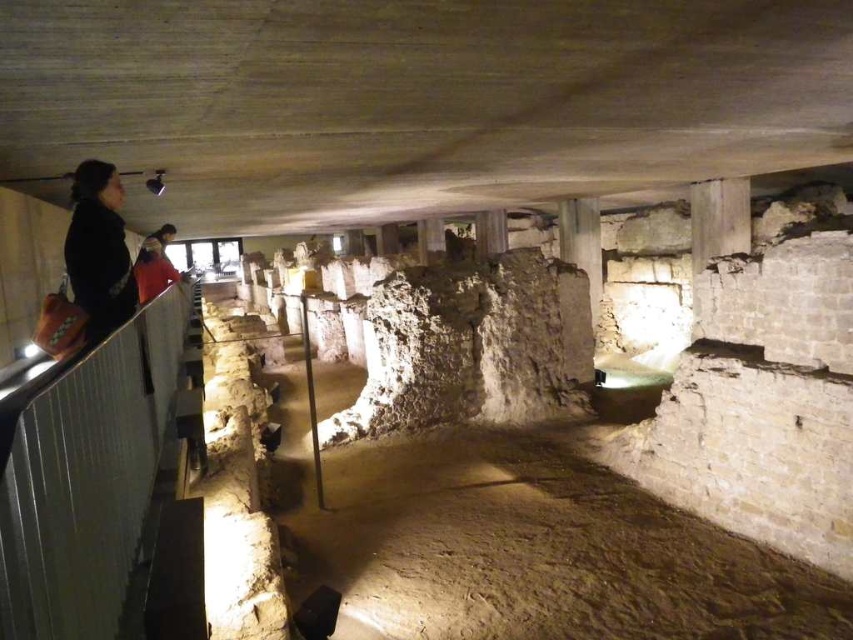
Looking at this image, does metal/rustic rail at left have a larger size compared to orange fabric jacket at upper left?

Yes.

Does point (140, 401) come in front of point (163, 256)?

Yes, point (140, 401) is closer to viewer.

Identify the location of metal/rustic rail at left. (90, 481).

Who is shorter, metal/rustic rail at left or black fabric bag at upper left?

With less height is metal/rustic rail at left.

Is metal/rustic rail at left shorter than black fabric bag at upper left?

Yes, metal/rustic rail at left is shorter than black fabric bag at upper left.

Where is `metal/rustic rail at left`? metal/rustic rail at left is located at coordinates (90, 481).

Which is more to the right, black fabric bag at upper left or orange fabric jacket at upper left?

Positioned to the right is black fabric bag at upper left.

In the scene shown: Between black fabric bag at upper left and orange fabric jacket at upper left, which one appears on the left side from the viewer's perspective?

Positioned to the left is orange fabric jacket at upper left.

Where is `black fabric bag at upper left`? Image resolution: width=853 pixels, height=640 pixels. black fabric bag at upper left is located at coordinates (97, 250).

Locate an element on the screen. This screenshot has height=640, width=853. black fabric bag at upper left is located at coordinates (97, 250).